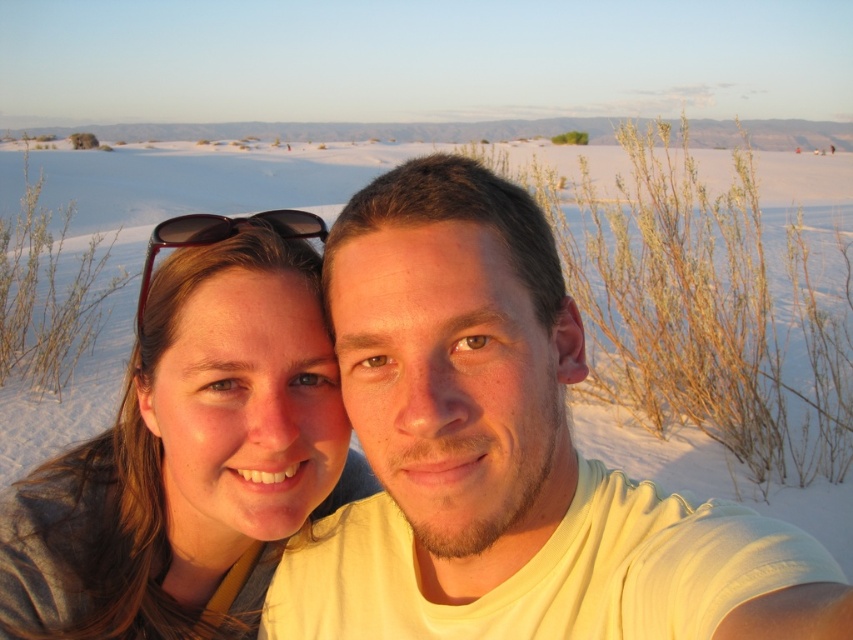
Based on the photo, you are a photographer trying to capture the two friends in the desert. You notice the yellow cotton shirt at center and the matte gray hair at left. Which friend should you focus on first if you want to photograph them from left to right order?

You should focus on the matte gray hair at left first because it is positioned on the left side of the yellow cotton shirt at center.

Looking at the desert selfie, can you tell me which object is positioned to the right of the other between the matte gray hair at left and the black matte sunglasses at upper left?

The matte gray hair at left is positioned to the right of the black matte sunglasses at upper left.

You are a photographer trying to capture a closeup shot of the matte gray hair at left and the black matte sunglasses at upper left. Which object should you zoom in on to ensure it takes up more space in the photo?

The matte gray hair at left should be zoomed in on because its width surpasses that of the black matte sunglasses at upper left, meaning it naturally occupies more space and would fill the frame better.